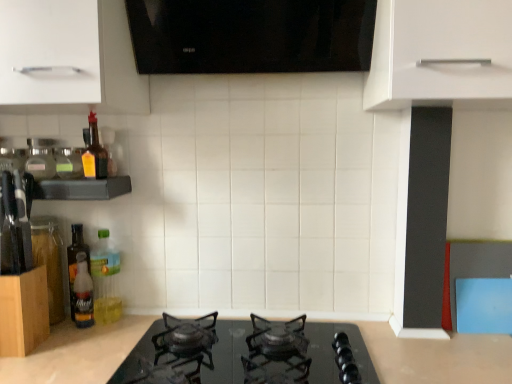
Question: Is white matte cabinet handle at upper left, marked as the second cabinetry in a bottom-to-top arrangement, oriented away from translucent glass bottle at left, placed as the fifth bottle when sorted from right to left?

Choices:
 (A) no
 (B) yes

Answer: (A)

Question: Is white matte cabinet handle at upper left, which is counted as the first cabinetry, starting from the top, smaller than translucent glass bottle at left, placed as the fifth bottle when sorted from right to left?

Choices:
 (A) no
 (B) yes

Answer: (A)

Question: Would you say white matte cabinet handle at upper left, which is counted as the first cabinetry, starting from the top, contains translucent glass bottle at left, placed as the fifth bottle when sorted from right to left?

Choices:
 (A) no
 (B) yes

Answer: (A)

Question: Does white matte cabinet handle at upper left, which is counted as the first cabinetry, starting from the top, have a larger size compared to translucent glass bottle at left, placed as the fifth bottle when sorted from right to left?

Choices:
 (A) no
 (B) yes

Answer: (B)

Question: Is the depth of white matte cabinet handle at upper left, which is counted as the first cabinetry, starting from the top, less than that of translucent glass bottle at left, placed as the fifth bottle when sorted from right to left?

Choices:
 (A) no
 (B) yes

Answer: (B)

Question: Can you confirm if white matte cabinet handle at upper left, which is counted as the first cabinetry, starting from the top, is positioned to the left of translucent glass bottle at left, which is counted as the 2th bottle, starting from the left?

Choices:
 (A) yes
 (B) no

Answer: (B)

Question: Does translucent amber glass bottle at left, positioned as the second bottle in right-to-left order, turn towards clear glass jar at left, the 1th bottle from the left?

Choices:
 (A) yes
 (B) no

Answer: (B)

Question: Considering the relative positions of translucent amber glass bottle at left, positioned as the second bottle in right-to-left order, and clear glass jar at left, the 1th bottle from the left, in the image provided, is translucent amber glass bottle at left, positioned as the second bottle in right-to-left order, behind clear glass jar at left, the 1th bottle from the left,?

Choices:
 (A) no
 (B) yes

Answer: (A)

Question: Would you say translucent amber glass bottle at left, positioned as the 5th bottle in left-to-right order, is outside clear glass jar at left, the 1th bottle from the left?

Choices:
 (A) no
 (B) yes

Answer: (B)

Question: From the image's perspective, would you say translucent amber glass bottle at left, positioned as the second bottle in right-to-left order, is positioned over clear glass jar at left, the 6th bottle from the right?

Choices:
 (A) no
 (B) yes

Answer: (B)

Question: Does translucent amber glass bottle at left, positioned as the 5th bottle in left-to-right order, appear on the left side of clear glass jar at left, the 6th bottle from the right?

Choices:
 (A) no
 (B) yes

Answer: (A)

Question: Is translucent amber glass bottle at left, positioned as the second bottle in right-to-left order, beside clear glass jar at left, the 6th bottle from the right?

Choices:
 (A) no
 (B) yes

Answer: (A)

Question: Does translucent glass bottle at left, which is counted as the 2th bottle, starting from the left, lie in front of white matte cabinet handle at upper left, which is counted as the first cabinetry, starting from the top?

Choices:
 (A) yes
 (B) no

Answer: (B)